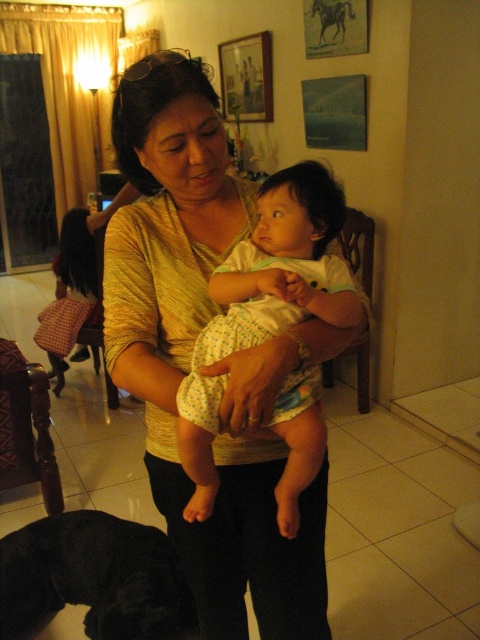
You are a photographer setting up a shoot in this room. You need to ensure that both the yellow textured blouse at center and the white dotted fabric baby at center are fully visible in the frame. Given their positions and sizes, which object should you focus on first to ensure both are in focus?

The yellow textured blouse at center is taller than the white dotted fabric baby at center, so focusing on the taller object first will help ensure both are in focus as the baby is smaller and positioned lower.

You are an interior designer assessing the layout of this room. You need to place a 1.2 meter tall plant stand between the yellow textured blouse at center and the black fur dog at lower left. Will the plant stand fit vertically between them?

The yellow textured blouse at center is taller than the black fur dog at lower left. Since the plant stand is 1.2 meters tall, it may not fit vertically between them if the space between their heights is less than 1.2 meters. However, without exact measurements of the vertical distance between them, it is impossible to determine for sure.

You are a photographer standing at the camera position. You want to take a closeup photo of the black fur dog at lower left without moving the dog. Can you step forward to get closer? Explain why or why not based on the dog distance.

The black fur dog at lower left is 1.41 meters away from the camera. Since photographers can move closer unless restricted by space or other factors, stepping forward to reduce the distance would allow a closer shot. However, ensure not to disturb the dog or the main scene.